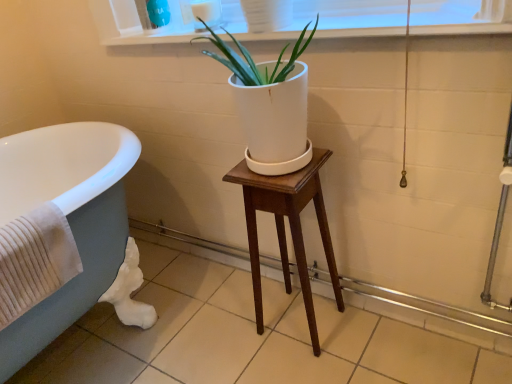
Locate an element on the screen. This screenshot has height=384, width=512. free point below mahogany wood stool at center (from a real-world perspective) is located at coordinates (296, 329).